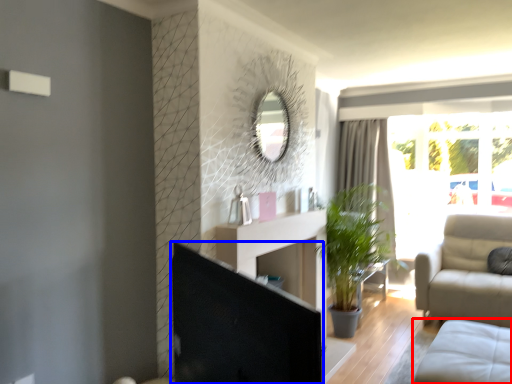
Question: Which object is closer to the camera taking this photo, studio couch (highlighted by a red box) or screen door (highlighted by a blue box)?

Choices:
 (A) studio couch
 (B) screen door

Answer: (B)